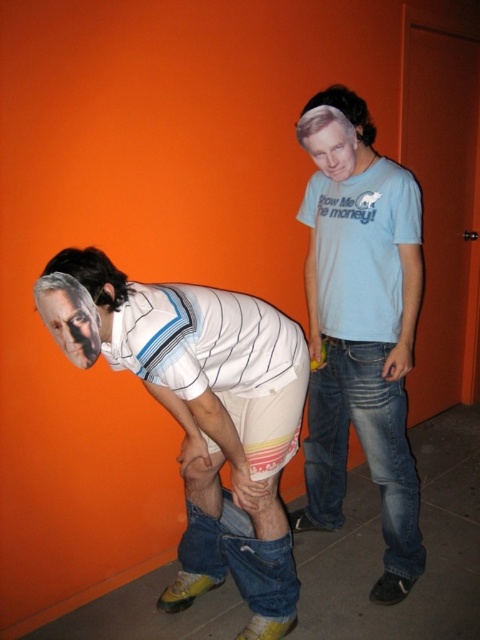
Describe the element at coordinates (215, 422) in the screenshot. I see `white striped shirt at lower left` at that location.

Which is more to the right, white striped shirt at lower left or light blue cotton t-shirt at upper right?

Positioned to the right is light blue cotton t-shirt at upper right.

Is point (54, 272) positioned after point (382, 323)?

That is False.

At what (x,y) coordinates should I click in order to perform the action: click on white striped shirt at lower left. Please return your answer as a coordinate pair (x, y). Looking at the image, I should click on (215, 422).

Does white striped shirt at lower left appear on the right side of smooth plastic face at lower left?

Correct, you'll find white striped shirt at lower left to the right of smooth plastic face at lower left.

Can you confirm if white striped shirt at lower left is positioned to the left of smooth plastic face at lower left?

No, white striped shirt at lower left is not to the left of smooth plastic face at lower left.

Which is behind, point (180, 577) or point (72, 332)?

The point (180, 577) is more distant.

I want to click on white striped shirt at lower left, so click(215, 422).

Does light blue cotton t-shirt at upper right have a greater width compared to smooth plastic face at lower left?

Correct, the width of light blue cotton t-shirt at upper right exceeds that of smooth plastic face at lower left.

Where is `light blue cotton t-shirt at upper right`? light blue cotton t-shirt at upper right is located at coordinates (362, 339).